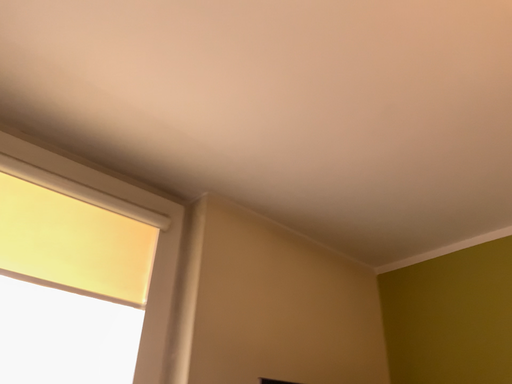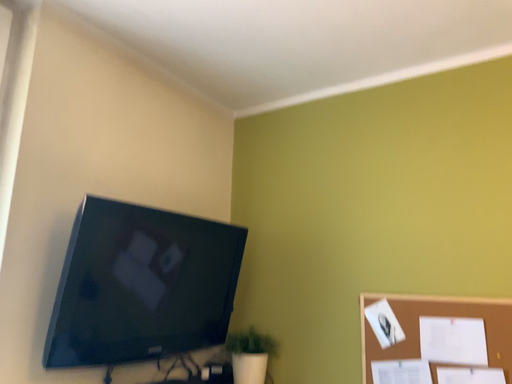
Question: Which way did the camera rotate in the video?

Choices:
 (A) rotated upward
 (B) rotated downward

Answer: (B)